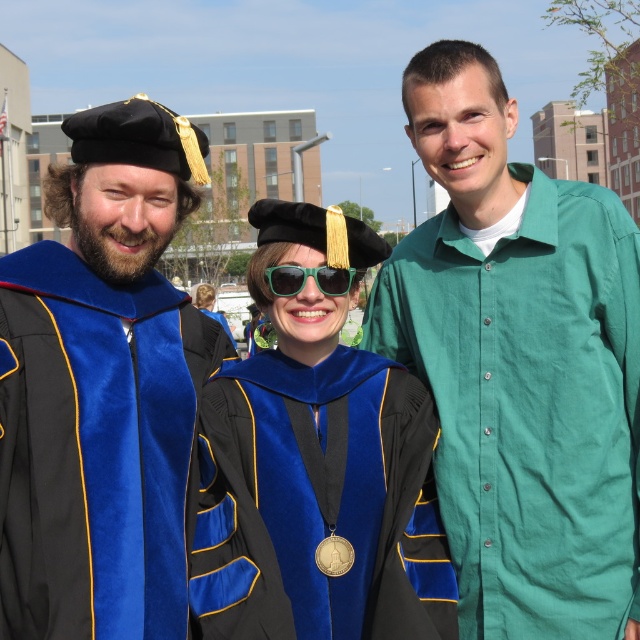
Does green cotton shirt at right appear on the right side of velvet blue graduation gown at center?

Correct, you'll find green cotton shirt at right to the right of velvet blue graduation gown at center.

Which is in front, point (499, 609) or point (307, 410)?

Point (307, 410) is in front.

Locate an element on the screen. This screenshot has height=640, width=640. green cotton shirt at right is located at coordinates (518, 364).

Does velvet blue graduation gown at center appear under green plastic sunglasses at center?

Yes.

This screenshot has width=640, height=640. What are the coordinates of `velvet blue graduation gown at center` in the screenshot? It's located at (320, 464).

Is point (163, 593) positioned behind point (280, 296)?

No, it is not.

Between velvet blue graduation gown at left and green plastic sunglasses at center, which one appears on the left side from the viewer's perspective?

velvet blue graduation gown at left

Is point (120, 509) less distant than point (269, 276)?

Yes, point (120, 509) is closer to viewer.

Find the location of a particular element. The width and height of the screenshot is (640, 640). velvet blue graduation gown at left is located at coordinates (100, 387).